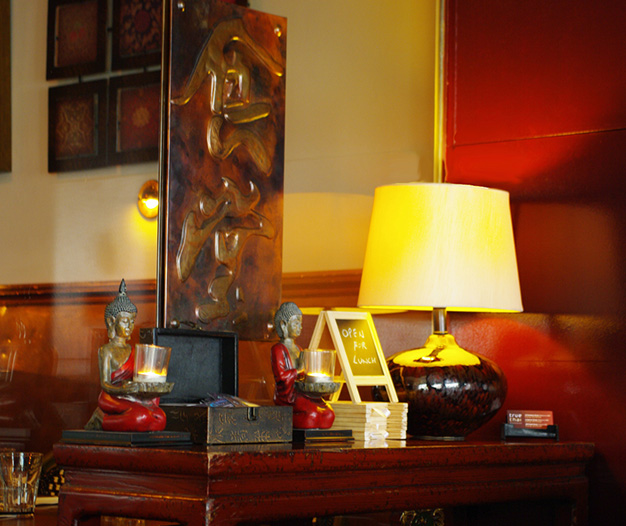
Identify the location of red wall. (553, 141).